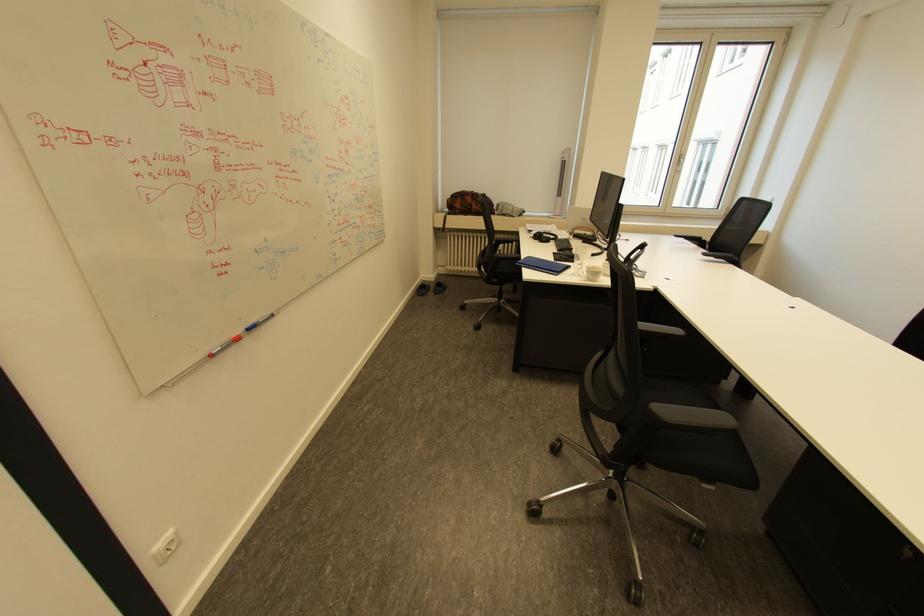
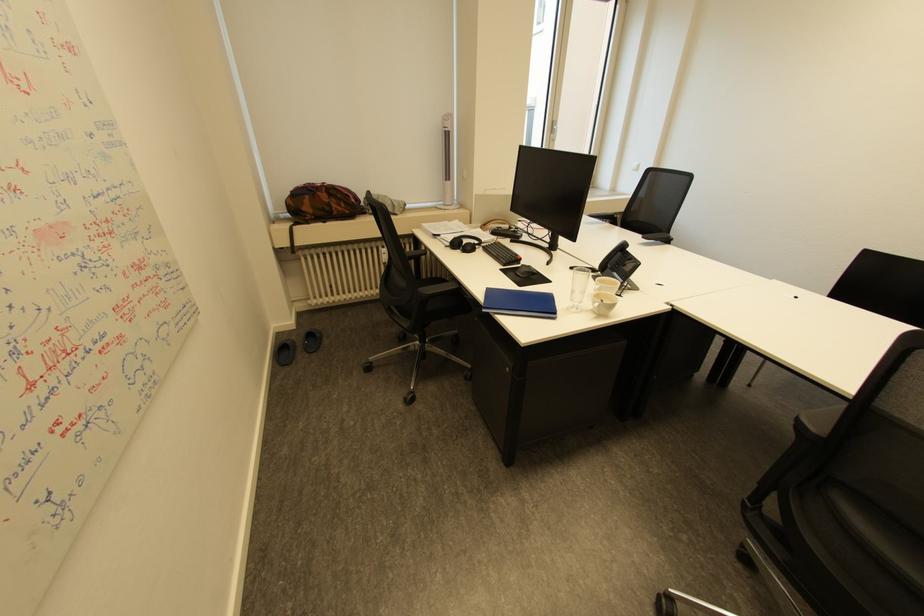
Find the pixel in the second image that matches pixel 565 256 in the first image.

(518, 274)